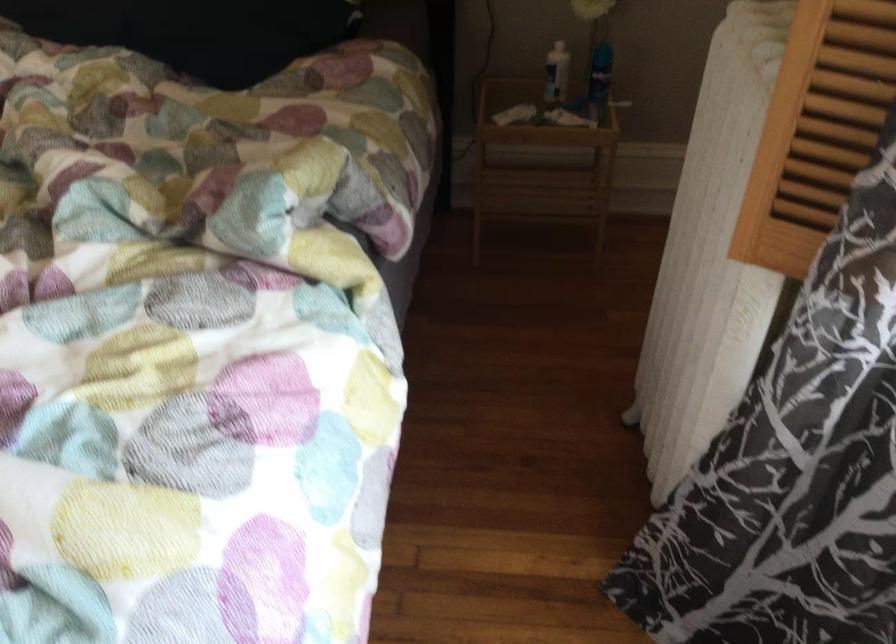
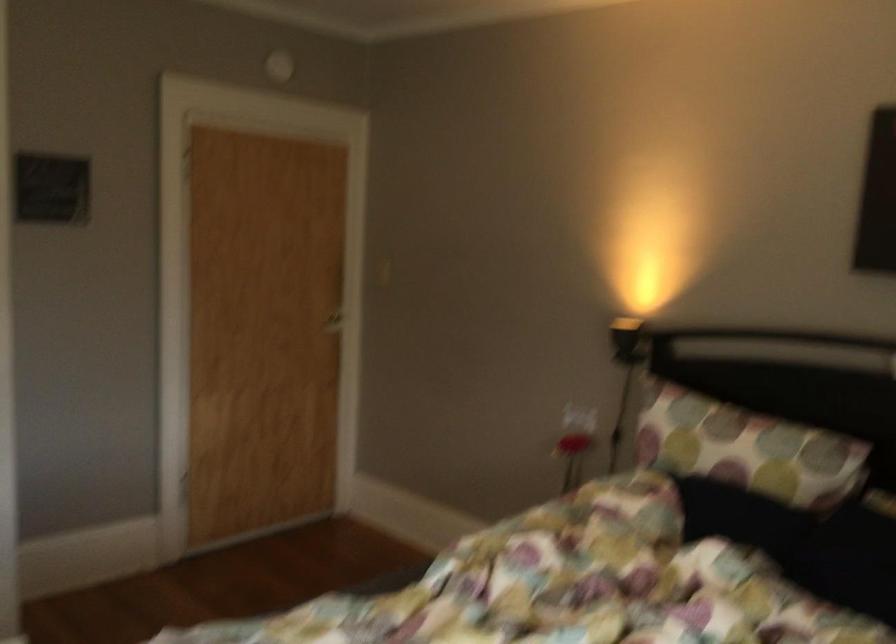
How did the camera likely rotate?

The rotation direction of the camera is left-up.